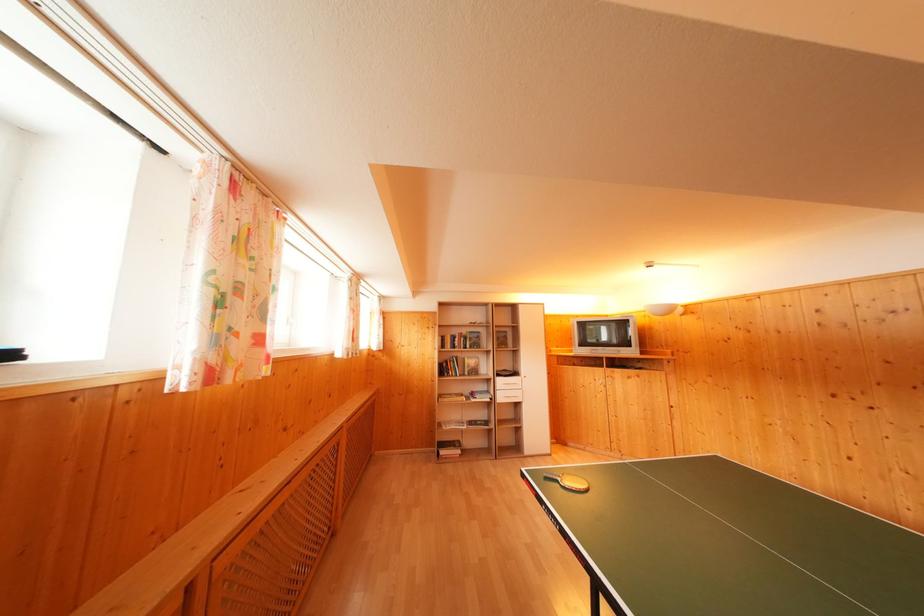
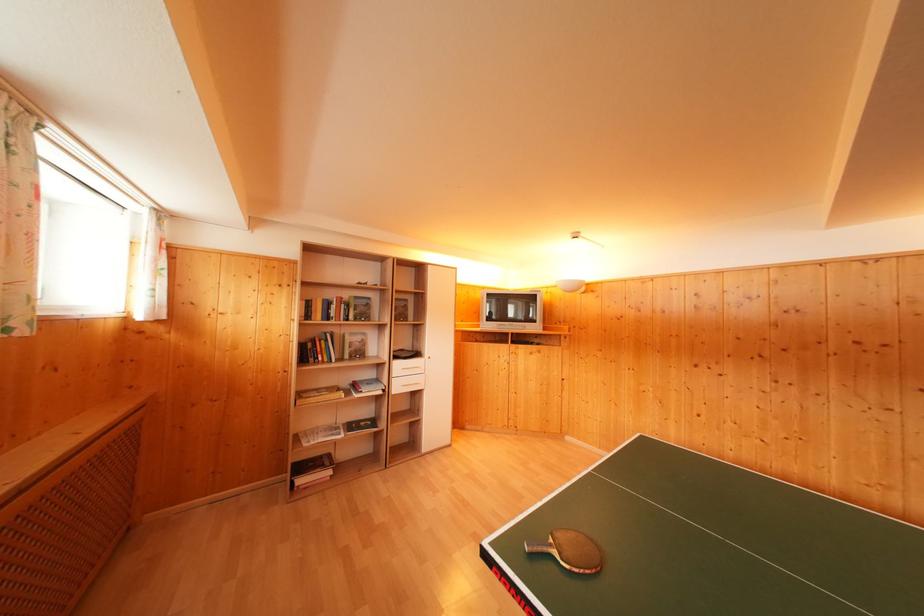
Find the pixel in the second image that matches [466,397] in the first image.

(341, 390)